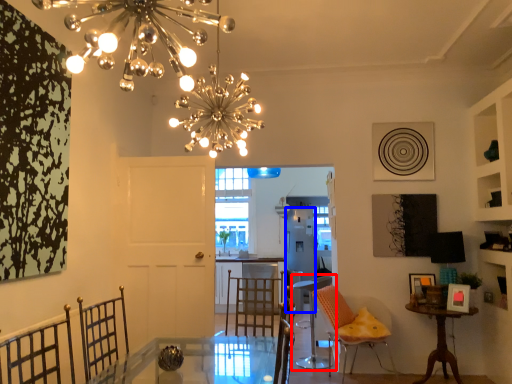
Question: Which of the following is the farthest to the observer, chair (highlighted by a red box) or appliance (highlighted by a blue box)?

Choices:
 (A) chair
 (B) appliance

Answer: (B)